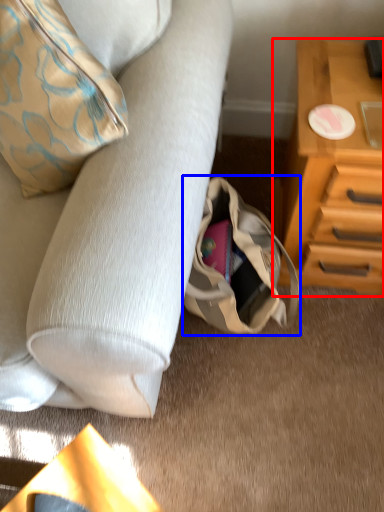
Question: Which object is closer to the camera taking this photo, chest of drawers (highlighted by a red box) or handbag (highlighted by a blue box)?

Choices:
 (A) chest of drawers
 (B) handbag

Answer: (A)